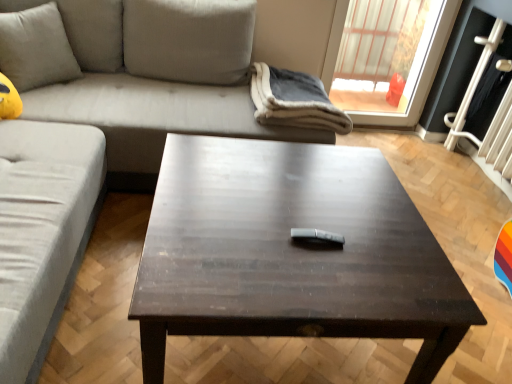
Find the location of `blank space to the left of satin silver remote at center`. blank space to the left of satin silver remote at center is located at coordinates (264, 234).